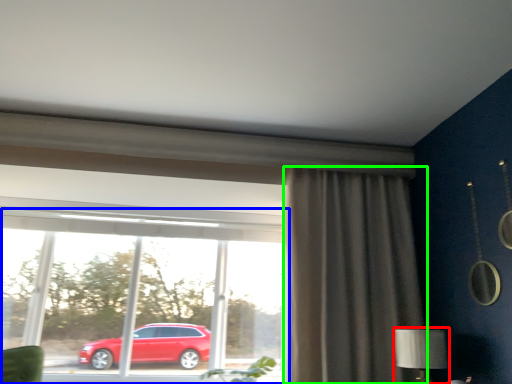
Question: Which is nearer to the table lamp (highlighted by a red box)? window (highlighted by a blue box) or curtain (highlighted by a green box).

Choices:
 (A) window
 (B) curtain

Answer: (B)